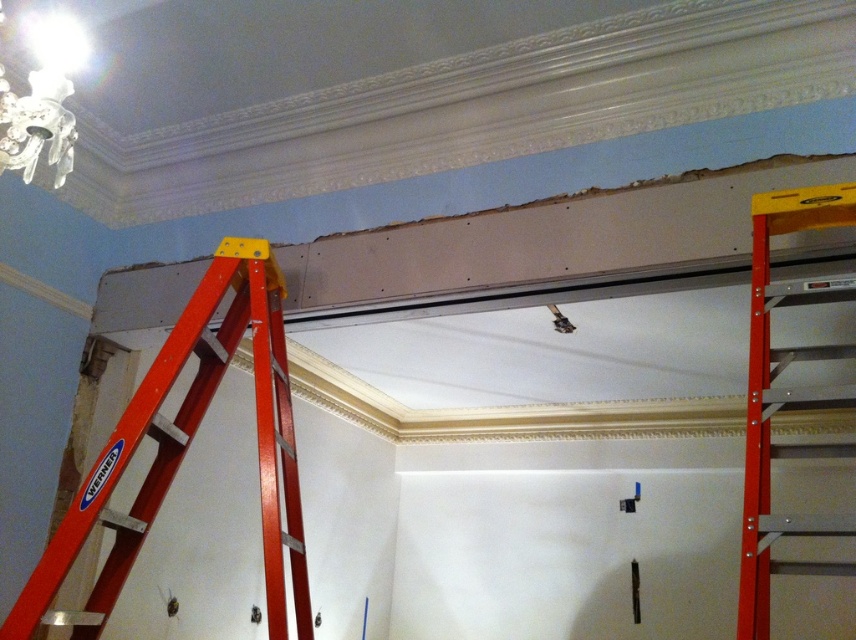
Does matte white chandelier at upper left lie behind metallic silver tool at center?

That is False.

Can you confirm if matte white chandelier at upper left is positioned to the right of metallic silver tool at center?

No, matte white chandelier at upper left is not to the right of metallic silver tool at center.

The height and width of the screenshot is (640, 856). Identify the location of matte white chandelier at upper left. (39, 116).

Identify the location of matte white chandelier at upper left. point(39,116).

Is point (818, 531) positioned in front of point (565, 321)?

Yes, point (818, 531) is in front of point (565, 321).

Does metallic orange ladder at center have a lesser width compared to metallic silver tool at center?

Incorrect, metallic orange ladder at center's width is not less than metallic silver tool at center's.

This screenshot has width=856, height=640. Describe the element at coordinates (788, 396) in the screenshot. I see `metallic orange ladder at center` at that location.

In order to click on metallic orange ladder at center in this screenshot , I will do pos(788,396).

Can you confirm if metallic orange ladder at left is positioned below metallic orange ladder at center?

Yes, metallic orange ladder at left is below metallic orange ladder at center.

Is metallic orange ladder at left thinner than metallic orange ladder at center?

In fact, metallic orange ladder at left might be wider than metallic orange ladder at center.

Is point (274, 314) behind point (747, 563)?

Yes, point (274, 314) is behind point (747, 563).

Where is `metallic orange ladder at left`? metallic orange ladder at left is located at coordinates (187, 445).